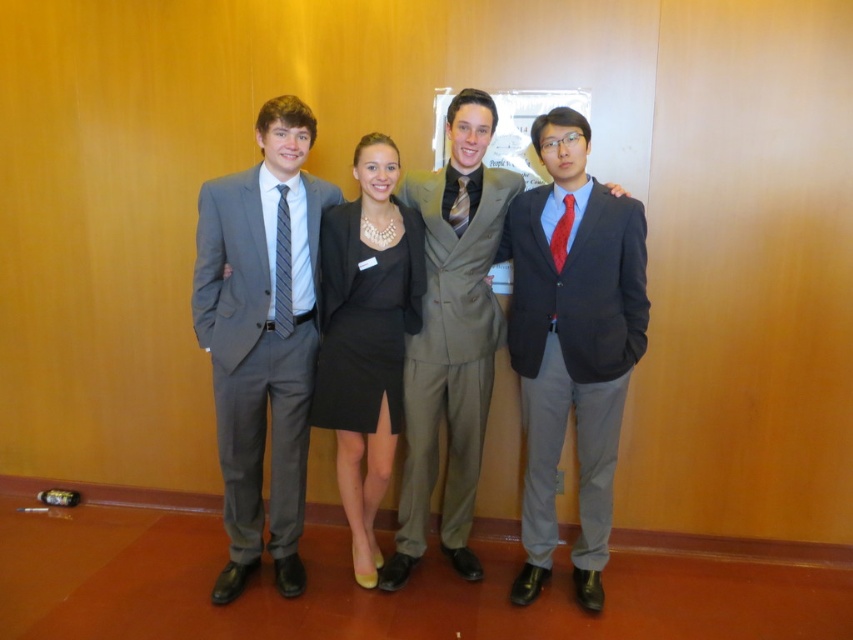
Who is more forward, (283, 420) or (431, 384)?

Point (283, 420) is more forward.

Which is above, matte gray suit at left or satin gray suit at center?

matte gray suit at left is above.

Between point (219, 424) and point (440, 522), which one is positioned behind?

Point (440, 522)

At what (x,y) coordinates should I click in order to perform the action: click on matte gray suit at left. Please return your answer as a coordinate pair (x, y). Image resolution: width=853 pixels, height=640 pixels. Looking at the image, I should click on (260, 340).

Who is positioned more to the right, matte gray suit at center or red satin tie at right?

red satin tie at right

This screenshot has width=853, height=640. What do you see at coordinates (451, 340) in the screenshot? I see `matte gray suit at center` at bounding box center [451, 340].

Identify the location of matte gray suit at center. This screenshot has height=640, width=853. (451, 340).

Is satin gray suit at center wider than striped silk tie at center?

Yes, satin gray suit at center is wider than striped silk tie at center.

Can you confirm if satin gray suit at center is bigger than striped silk tie at center?

Yes, satin gray suit at center is bigger than striped silk tie at center.

Identify the location of satin gray suit at center. (450, 349).